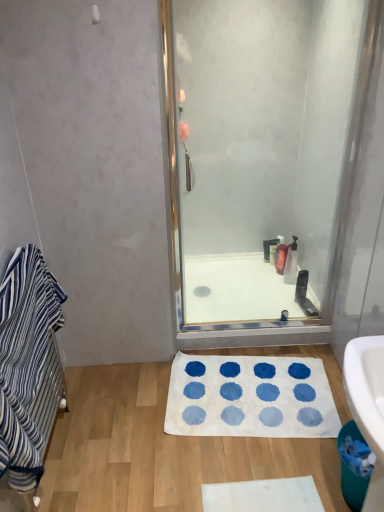
Question: Considering the relative sizes of translucent plastic bottle at upper right, marked as the second toiletry in a front-to-back arrangement, and white soft bath mat at center in the image provided, is translucent plastic bottle at upper right, marked as the second toiletry in a front-to-back arrangement, wider than white soft bath mat at center?

Choices:
 (A) no
 (B) yes

Answer: (A)

Question: Is white soft bath mat at center inside translucent plastic bottle at upper right, which ranks as the third toiletry in back-to-front order?

Choices:
 (A) yes
 (B) no

Answer: (B)

Question: Is translucent plastic bottle at upper right, marked as the second toiletry in a front-to-back arrangement, bigger than white soft bath mat at center?

Choices:
 (A) no
 (B) yes

Answer: (A)

Question: From a real-world perspective, does translucent plastic bottle at upper right, marked as the second toiletry in a front-to-back arrangement, sit lower than white soft bath mat at center?

Choices:
 (A) no
 (B) yes

Answer: (A)

Question: Is translucent plastic bottle at upper right, which ranks as the third toiletry in back-to-front order, not close to white soft bath mat at center?

Choices:
 (A) no
 (B) yes

Answer: (A)

Question: From a real-world perspective, is white soft bath mat at center positioned above or below white glossy bath at center?

Choices:
 (A) below
 (B) above

Answer: (A)

Question: Is white soft bath mat at center situated inside white glossy bath at center or outside?

Choices:
 (A) inside
 (B) outside

Answer: (B)

Question: Visually, is white soft bath mat at center positioned to the left or to the right of white glossy bath at center?

Choices:
 (A) left
 (B) right

Answer: (A)

Question: Considering their positions, is white soft bath mat at center located in front of or behind white glossy bath at center?

Choices:
 (A) front
 (B) behind

Answer: (A)

Question: Would you say translucent plastic soap dispenser at center, placed as the 4th toiletry when sorted from front to back, is to the left or to the right of translucent plastic soap dispenser at center, arranged as the 2th toiletry when viewed from the back, in the picture?

Choices:
 (A) left
 (B) right

Answer: (B)

Question: Is point (279, 234) closer or farther from the camera than point (276, 262)?

Choices:
 (A) farther
 (B) closer

Answer: (A)

Question: From a real-world perspective, is translucent plastic soap dispenser at center, placed as the first toiletry when sorted from back to front, physically located above or below translucent plastic soap dispenser at center, arranged as the 2th toiletry when viewed from the back?

Choices:
 (A) above
 (B) below

Answer: (A)

Question: From their relative heights in the image, would you say translucent plastic soap dispenser at center, placed as the 4th toiletry when sorted from front to back, is taller or shorter than translucent plastic soap dispenser at center, the third toiletry in the front-to-back sequence?

Choices:
 (A) tall
 (B) short

Answer: (A)

Question: In terms of width, does translucent plastic soap dispenser at center, the third toiletry in the front-to-back sequence, look wider or thinner when compared to white glossy bath at center?

Choices:
 (A) wide
 (B) thin

Answer: (B)

Question: From the image's perspective, is translucent plastic soap dispenser at center, arranged as the 2th toiletry when viewed from the back, positioned above or below white glossy bath at center?

Choices:
 (A) below
 (B) above

Answer: (B)